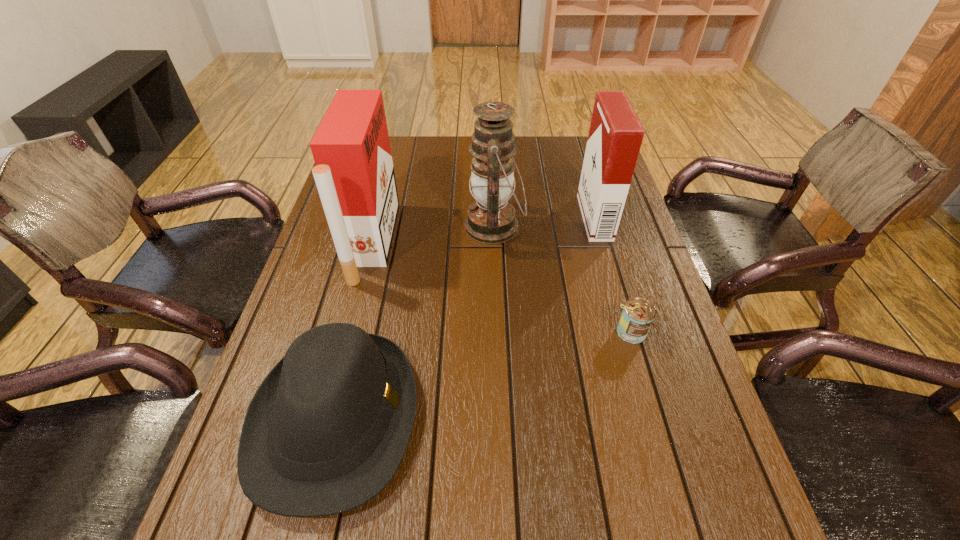
Identify the location of lantern. This screenshot has height=540, width=960. (491, 219).

The height and width of the screenshot is (540, 960). Find the location of `the left cigarette_case`. the left cigarette_case is located at coordinates (354, 174).

Identify the location of the right cigarette_case. The height and width of the screenshot is (540, 960). (615, 136).

Locate an element on the screen. Image resolution: width=960 pixels, height=540 pixels. the fourth tallest object is located at coordinates (325, 432).

Where is `can`? This screenshot has height=540, width=960. can is located at coordinates (638, 314).

Locate an element on the screen. vacant point located 0.310m on the left of the lantern is located at coordinates (357, 227).

The image size is (960, 540). I want to click on free region located 0.050m on the front-facing side of the left cigarette_case, so click(x=410, y=242).

At what (x,y) coordinates should I click in order to perform the action: click on free space located on the front-facing side of the right cigarette_case. Please return your answer as a coordinate pair (x, y). Looking at the image, I should click on (518, 218).

Identify the location of vacant region located 0.260m on the front-facing side of the right cigarette_case. The image size is (960, 540). (495, 218).

This screenshot has height=540, width=960. What are the coordinates of `vacant space situated on the front-facing side of the right cigarette_case` in the screenshot? It's located at (525, 218).